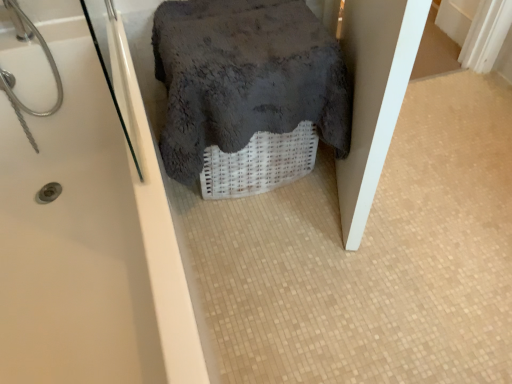
Question: From the image's perspective, is dark gray fluffy towel at center over white glossy bathtub at upper left?

Choices:
 (A) yes
 (B) no

Answer: (A)

Question: Considering the relative sizes of dark gray fluffy towel at center and white glossy bathtub at upper left in the image provided, is dark gray fluffy towel at center taller than white glossy bathtub at upper left?

Choices:
 (A) no
 (B) yes

Answer: (A)

Question: Is dark gray fluffy towel at center wider than white glossy bathtub at upper left?

Choices:
 (A) yes
 (B) no

Answer: (B)

Question: Is the surface of dark gray fluffy towel at center in direct contact with white glossy bathtub at upper left?

Choices:
 (A) no
 (B) yes

Answer: (A)

Question: Is dark gray fluffy towel at center oriented towards white glossy bathtub at upper left?

Choices:
 (A) no
 (B) yes

Answer: (A)

Question: Is dark gray fluffy towel at center thinner than white glossy bathtub at upper left?

Choices:
 (A) no
 (B) yes

Answer: (B)

Question: From a real-world perspective, is white glossy bathtub at upper left positioned over dark gray fluffy towel at center based on gravity?

Choices:
 (A) no
 (B) yes

Answer: (A)

Question: Considering the relative positions of white glossy bathtub at upper left and dark gray fluffy towel at center in the image provided, is white glossy bathtub at upper left behind dark gray fluffy towel at center?

Choices:
 (A) no
 (B) yes

Answer: (A)

Question: Is white glossy bathtub at upper left taller than dark gray fluffy towel at center?

Choices:
 (A) no
 (B) yes

Answer: (B)

Question: From the image's perspective, is white glossy bathtub at upper left on dark gray fluffy towel at center?

Choices:
 (A) yes
 (B) no

Answer: (B)

Question: Is white glossy bathtub at upper left not near dark gray fluffy towel at center?

Choices:
 (A) yes
 (B) no

Answer: (B)

Question: Does white glossy bathtub at upper left turn towards dark gray fluffy towel at center?

Choices:
 (A) yes
 (B) no

Answer: (A)

Question: In terms of height, does dark gray fluffy towel at center look taller or shorter compared to white glossy bathtub at upper left?

Choices:
 (A) short
 (B) tall

Answer: (A)